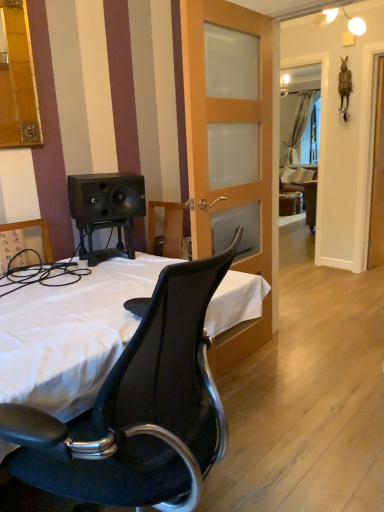
Question: From the image's perspective, is wooden frosted glass door at center beneath white fabric bed at center?

Choices:
 (A) no
 (B) yes

Answer: (A)

Question: From a real-world perspective, is wooden frosted glass door at center physically below white fabric bed at center?

Choices:
 (A) no
 (B) yes

Answer: (A)

Question: Is wooden frosted glass door at center smaller than white fabric bed at center?

Choices:
 (A) yes
 (B) no

Answer: (A)

Question: Is wooden frosted glass door at center facing away from white fabric bed at center?

Choices:
 (A) yes
 (B) no

Answer: (B)

Question: Does wooden frosted glass door at center have a lesser height compared to white fabric bed at center?

Choices:
 (A) no
 (B) yes

Answer: (A)

Question: Choose the correct answer: Is wooden frosted glass door at center inside clear glass screen door at right or outside it?

Choices:
 (A) inside
 (B) outside

Answer: (B)

Question: Is wooden frosted glass door at center bigger or smaller than clear glass screen door at right?

Choices:
 (A) small
 (B) big

Answer: (B)

Question: From the image's perspective, is wooden frosted glass door at center located above or below clear glass screen door at right?

Choices:
 (A) below
 (B) above

Answer: (A)

Question: Is wooden frosted glass door at center to the left or to the right of clear glass screen door at right in the image?

Choices:
 (A) right
 (B) left

Answer: (B)

Question: Would you say white sheer curtain at upper right is inside or outside white fabric bed at center?

Choices:
 (A) inside
 (B) outside

Answer: (B)

Question: Looking at their shapes, would you say white sheer curtain at upper right is wider or thinner than white fabric bed at center?

Choices:
 (A) wide
 (B) thin

Answer: (B)

Question: Would you say white sheer curtain at upper right is to the left or to the right of white fabric bed at center in the picture?

Choices:
 (A) right
 (B) left

Answer: (A)

Question: From the image's perspective, is white sheer curtain at upper right above or below white fabric bed at center?

Choices:
 (A) above
 (B) below

Answer: (A)

Question: In the image, is white fabric bed at center on the left side or the right side of wooden frosted glass door at center?

Choices:
 (A) left
 (B) right

Answer: (A)

Question: Would you say white fabric bed at center is inside or outside wooden frosted glass door at center?

Choices:
 (A) outside
 (B) inside

Answer: (A)